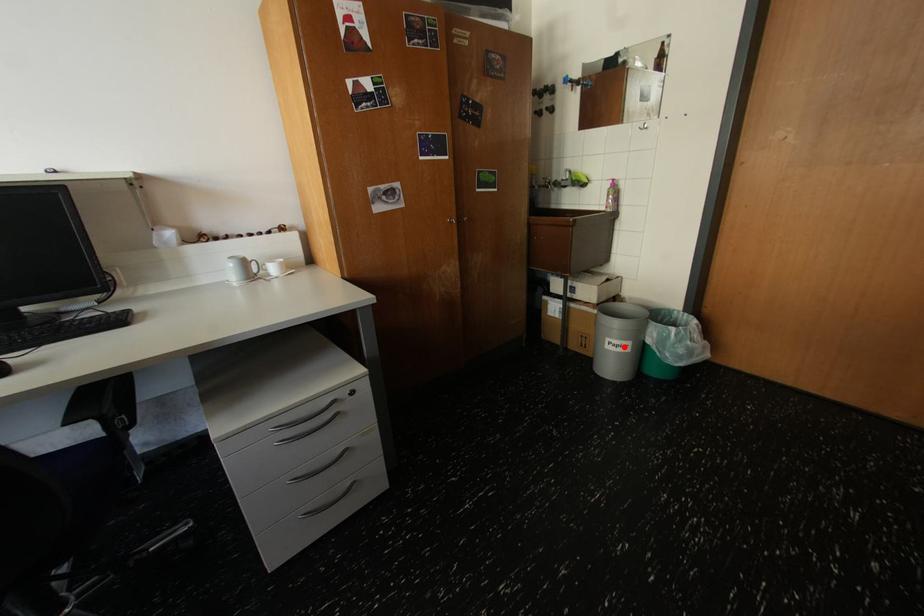
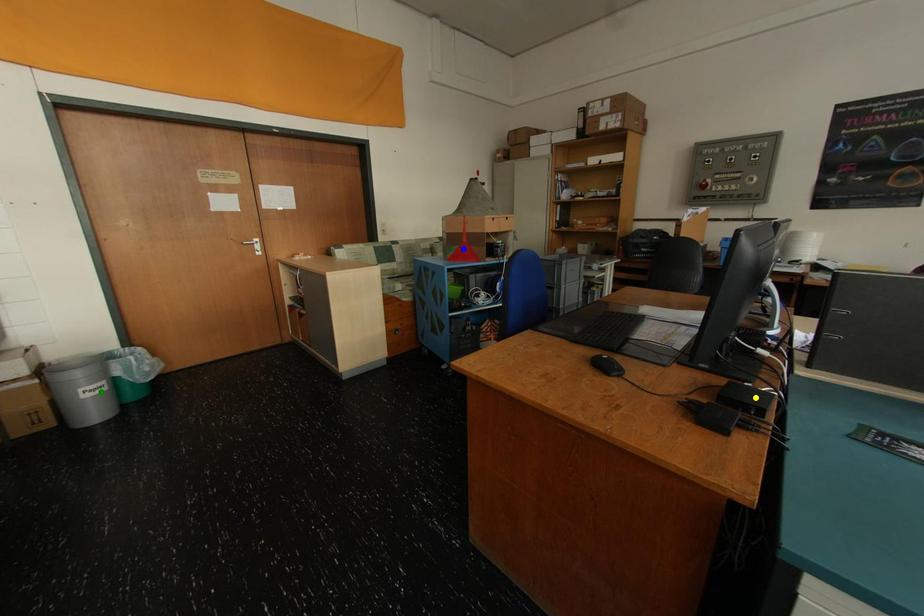
Question: I am providing you with two images of the same scene from different viewpoints. A red point is marked on the first image. You are given multiple points on the second image. Which point in image 2 is actually the same real-world point as the red point in image 1?

Choices:
 (A) yellow point
 (B) blue point
 (C) green point

Answer: (C)